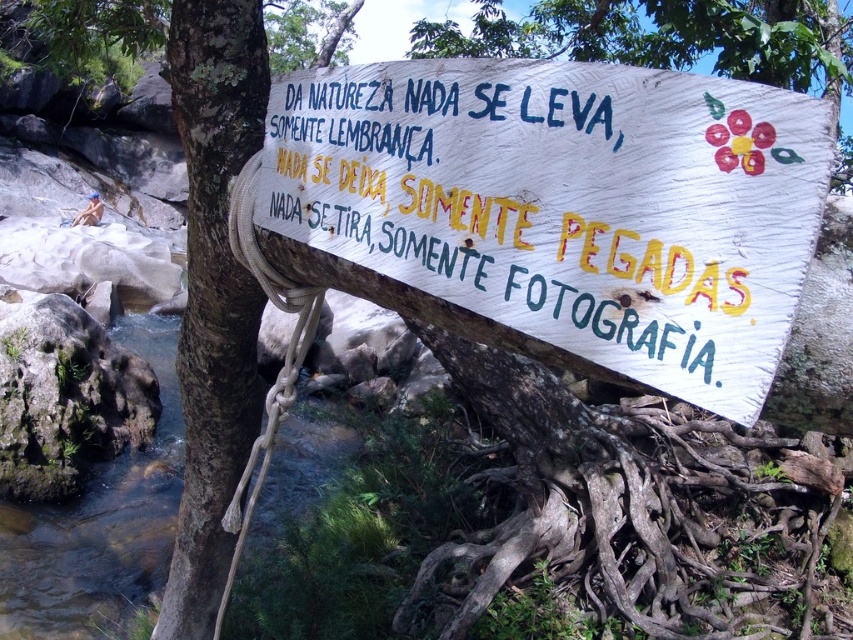
Which of these two, white wooden sign at center or clear water at creek right, stands shorter?

clear water at creek right

At what (x,y) coordinates should I click in order to perform the action: click on white wooden sign at center. Please return your answer as a coordinate pair (x, y). This screenshot has height=640, width=853. Looking at the image, I should click on (567, 204).

Is point (416, 61) positioned behind point (341, 452)?

No, (416, 61) is in front of (341, 452).

You are a GUI agent. You are given a task and a screenshot of the screen. Output one action in this format:
    pyautogui.click(x=<x>, y=<y>)
    Task: Click on the white wooden sign at center
    The image size is (853, 640).
    Given the screenshot: What is the action you would take?
    pyautogui.click(x=567, y=204)